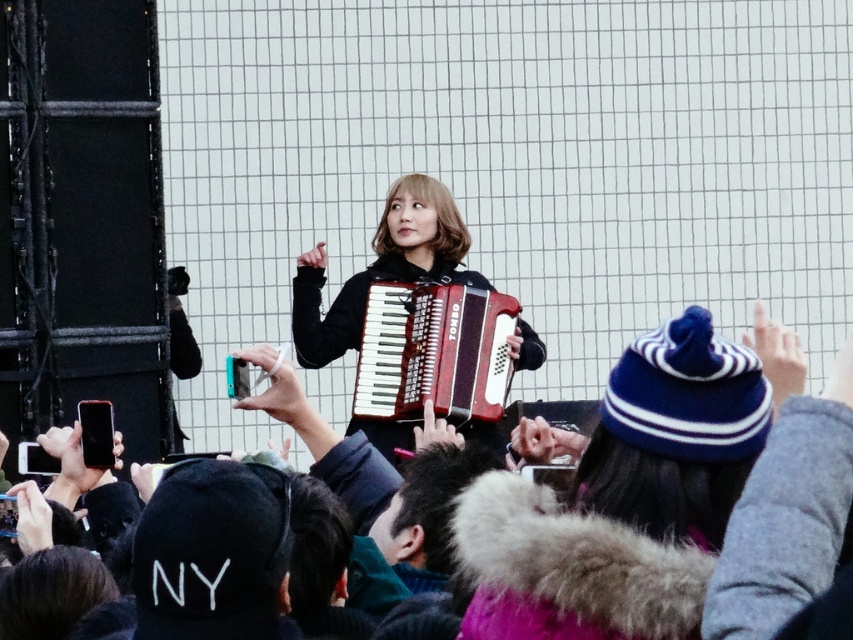
Is velvet blue beanie at center to the left of matte black accordion at center from the viewer's perspective?

In fact, velvet blue beanie at center is to the right of matte black accordion at center.

Does velvet blue beanie at center have a lesser height compared to matte black accordion at center?

Yes, velvet blue beanie at center is shorter than matte black accordion at center.

Is point (552, 604) farther from camera compared to point (300, 353)?

No.

The width and height of the screenshot is (853, 640). I want to click on velvet blue beanie at center, so 624,500.

Is point (639, 413) in front of point (405, 323)?

Yes.

Who is more forward, (663, 605) or (410, 323)?

Point (663, 605)

Is point (492, 534) in front of point (403, 282)?

Yes.

The image size is (853, 640). In order to click on velvet blue beanie at center in this screenshot , I will do `click(624, 500)`.

Between matte red wood accordion at center and matte black accordion at center, which one is positioned lower?

matte red wood accordion at center is below.

What do you see at coordinates (434, 352) in the screenshot? I see `matte red wood accordion at center` at bounding box center [434, 352].

Is point (474, 353) positioned behind point (361, 276)?

That is False.

Locate an element on the screen. This screenshot has width=853, height=640. matte red wood accordion at center is located at coordinates (434, 352).